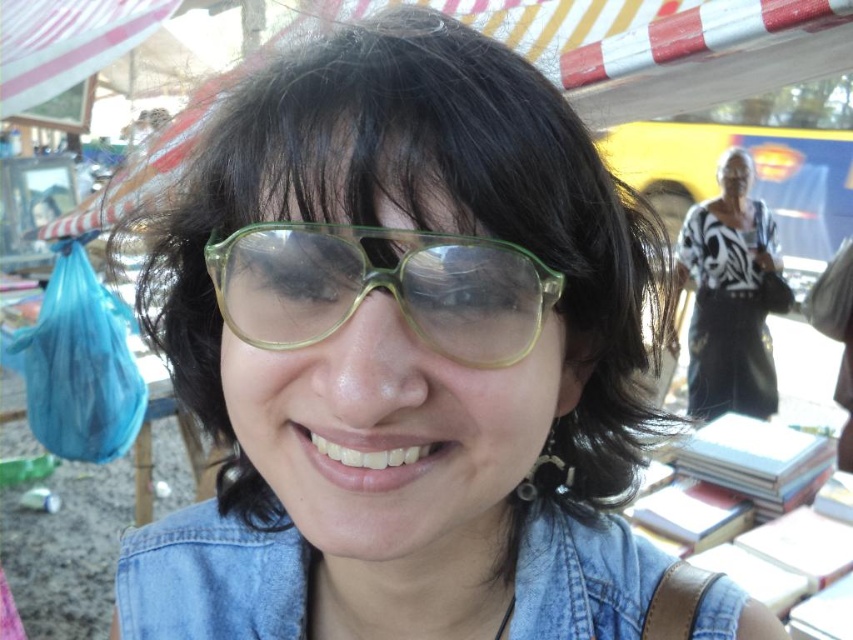
Find the location of `denim jacket at lower right`. denim jacket at lower right is located at coordinates (213, 579).

Can you confirm if denim jacket at lower right is positioned above translucent yellow-green goggles at center?

Actually, denim jacket at lower right is below translucent yellow-green goggles at center.

Is point (554, 593) less distant than point (469, 291)?

No, it is not.

Locate an element on the screen. denim jacket at lower right is located at coordinates (213, 579).

Who is more distant from viewer, (709, 632) or (744, 196)?

The point (744, 196) is behind.

Between denim jacket at lower right and black and white patterned sweater at upper right, which one has more height?

With more height is black and white patterned sweater at upper right.

Where is `denim jacket at lower right`? denim jacket at lower right is located at coordinates point(213,579).

Can you confirm if translucent yellow-green goggles at center is thinner than black and white patterned sweater at upper right?

Indeed, translucent yellow-green goggles at center has a lesser width compared to black and white patterned sweater at upper right.

Can you confirm if translucent yellow-green goggles at center is smaller than black and white patterned sweater at upper right?

Yes.

This screenshot has width=853, height=640. I want to click on translucent yellow-green goggles at center, so click(381, 285).

Find the location of a particular element. translucent yellow-green goggles at center is located at coordinates (381, 285).